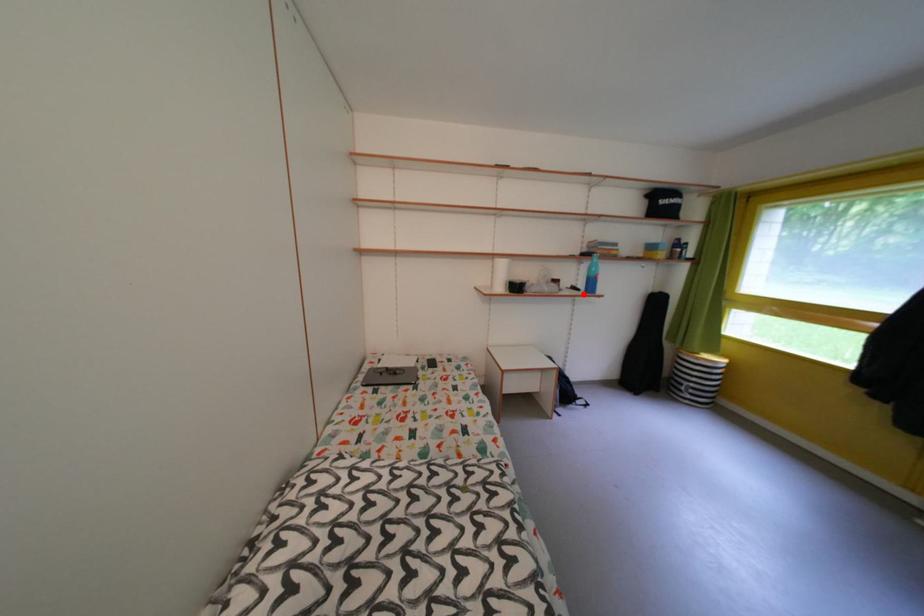
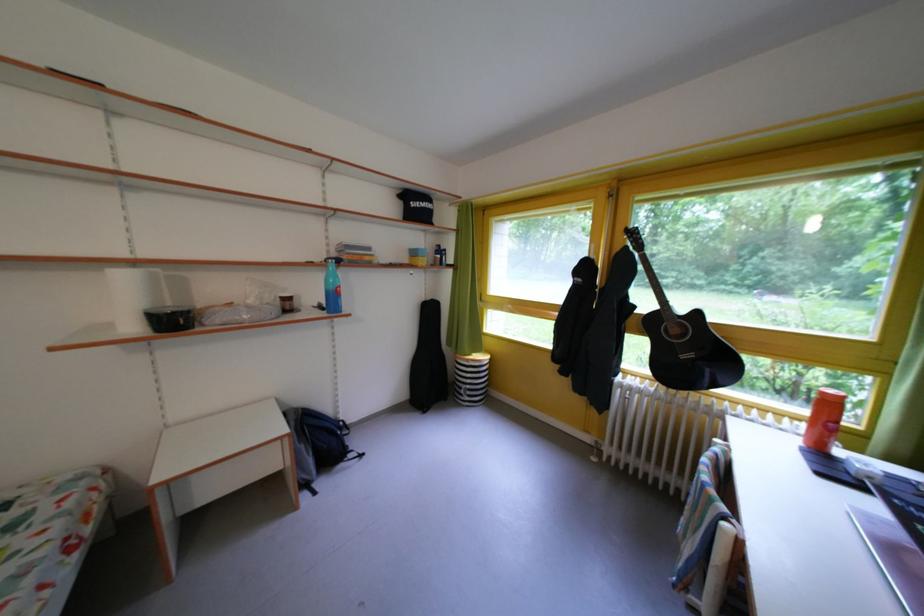
The point at the highlighted location is marked in the first image. Where is the corresponding point in the second image?

(331, 313)